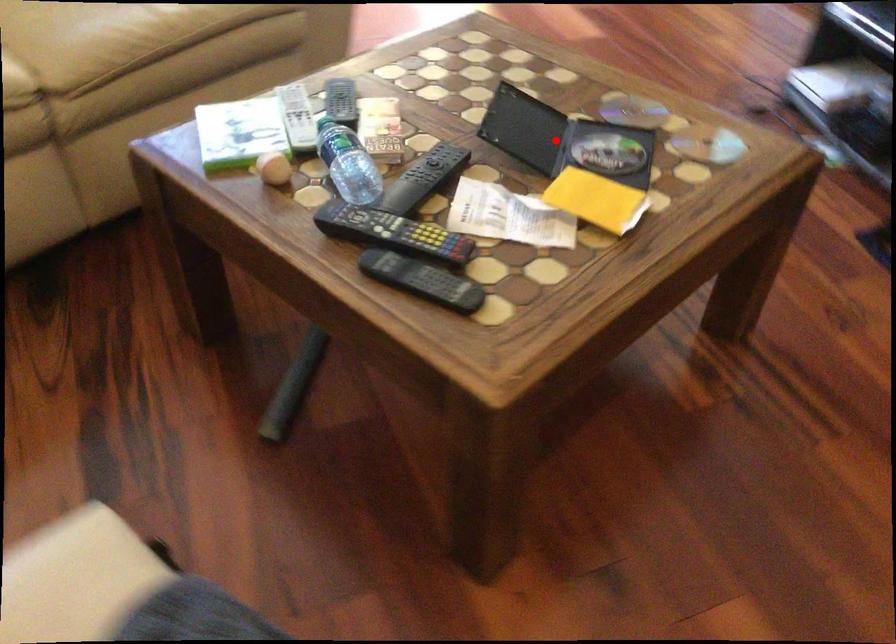
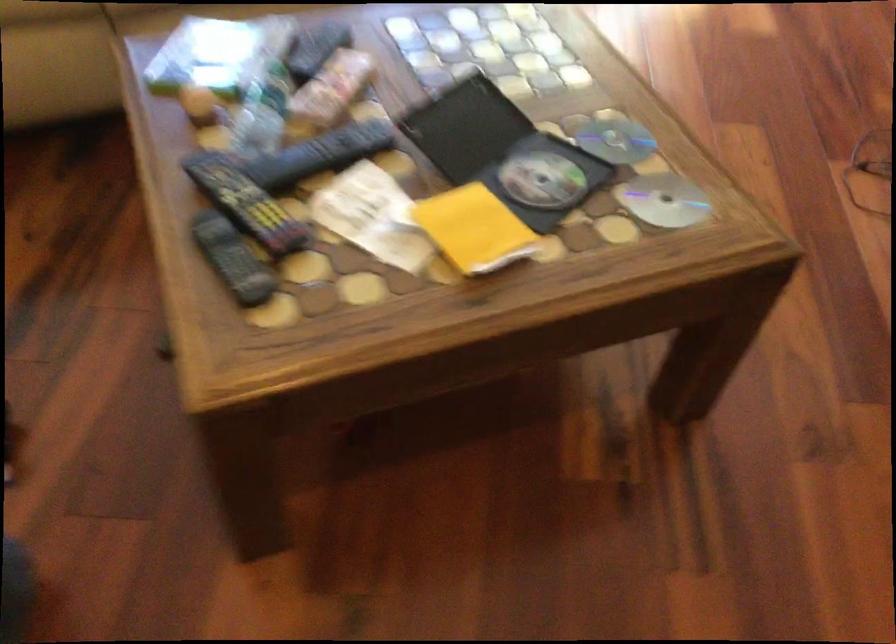
Question: A red point is marked in image1. In image2, is the corresponding 3D point closer to the camera or farther? Reply with the corresponding letter.

Choices:
 (A) The corresponding 3D point is closer.
 (B) The corresponding 3D point is farther.

Answer: (A)